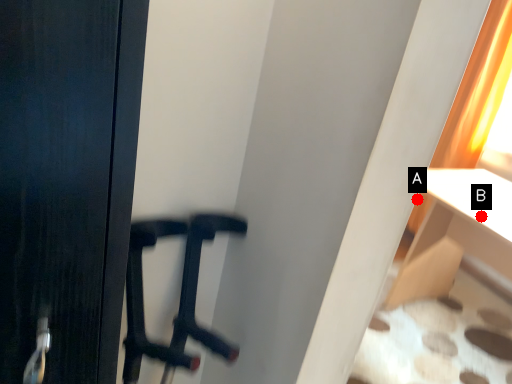
Question: Two points are circled on the image, labeled by A and B beside each circle. Which of the following is the closest to the observer?

Choices:
 (A) A is closer
 (B) B is closer

Answer: (A)